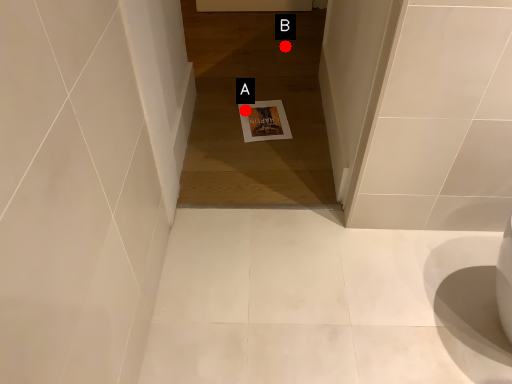
Question: Two points are circled on the image, labeled by A and B beside each circle. Which point is closer to the camera?

Choices:
 (A) A is closer
 (B) B is closer

Answer: (A)